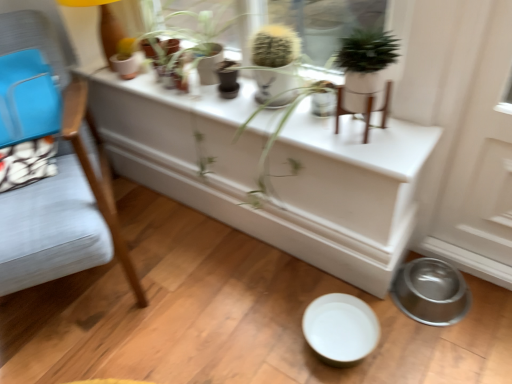
Question: Considering the relative positions of green matte plant at upper center, which appears as the first houseplant when viewed from the right, and matte white flowerpot at upper left in the image provided, is green matte plant at upper center, which appears as the first houseplant when viewed from the right, behind matte white flowerpot at upper left?

Choices:
 (A) no
 (B) yes

Answer: (A)

Question: From the image's perspective, would you say green matte plant at upper center, the first houseplant viewed from the front, is shown under matte white flowerpot at upper left?

Choices:
 (A) yes
 (B) no

Answer: (A)

Question: Is green matte plant at upper center, which appears as the first houseplant when viewed from the right, next to matte white flowerpot at upper left and touching it?

Choices:
 (A) no
 (B) yes

Answer: (A)

Question: Can you confirm if green matte plant at upper center, arranged as the second houseplant when viewed from the left, is taller than matte white flowerpot at upper left?

Choices:
 (A) no
 (B) yes

Answer: (B)

Question: Does green matte plant at upper center, the first houseplant viewed from the front, have a larger size compared to matte white flowerpot at upper left?

Choices:
 (A) no
 (B) yes

Answer: (B)

Question: Relative to light blue fabric chair at left, is fuzzy green cactus at upper center, which is the second houseplant in right-to-left order, in front or behind?

Choices:
 (A) front
 (B) behind

Answer: (B)

Question: Considering the positions of fuzzy green cactus at upper center, which appears as the 1th houseplant when viewed from the left, and light blue fabric chair at left in the image, is fuzzy green cactus at upper center, which appears as the 1th houseplant when viewed from the left, wider or thinner than light blue fabric chair at left?

Choices:
 (A) wide
 (B) thin

Answer: (B)

Question: In terms of size, does fuzzy green cactus at upper center, the second houseplant from the front, appear bigger or smaller than light blue fabric chair at left?

Choices:
 (A) big
 (B) small

Answer: (B)

Question: From a real-world perspective, relative to light blue fabric chair at left, is fuzzy green cactus at upper center, which appears as the 1th houseplant when viewed from the left, vertically above or below?

Choices:
 (A) above
 (B) below

Answer: (A)

Question: Is fuzzy green cactus at upper center, which is the 1th houseplant from back to front, taller or shorter than green matte plant at upper center, which appears as the 2th houseplant when viewed from the back?

Choices:
 (A) tall
 (B) short

Answer: (A)

Question: From the image's perspective, is fuzzy green cactus at upper center, the second houseplant from the front, positioned above or below green matte plant at upper center, arranged as the second houseplant when viewed from the left?

Choices:
 (A) above
 (B) below

Answer: (A)

Question: Would you say fuzzy green cactus at upper center, which is the second houseplant in right-to-left order, is to the left or to the right of green matte plant at upper center, which appears as the first houseplant when viewed from the right, in the picture?

Choices:
 (A) right
 (B) left

Answer: (B)

Question: From a real-world perspective, relative to green matte plant at upper center, which appears as the 2th houseplant when viewed from the back, is fuzzy green cactus at upper center, which is the 1th houseplant from back to front, vertically above or below?

Choices:
 (A) above
 (B) below

Answer: (B)

Question: Based on their positions, is matte white flowerpot at upper left located to the left or right of fuzzy green cactus at upper center, which appears as the 1th houseplant when viewed from the left?

Choices:
 (A) right
 (B) left

Answer: (B)

Question: In the image, is matte white flowerpot at upper left positioned in front of or behind fuzzy green cactus at upper center, which appears as the 1th houseplant when viewed from the left?

Choices:
 (A) front
 (B) behind

Answer: (B)